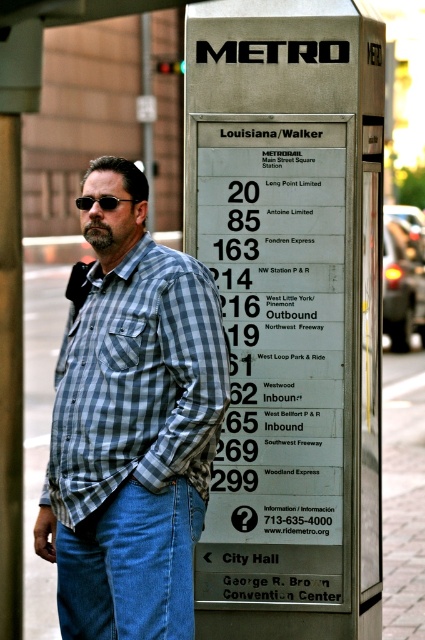
You are a delivery person who needs to read the METRO sign to catch your bus. You notice the metallic silver sign at center and the blue denim jeans at lower left. Which object is wider?

The metallic silver sign at center is wider than the blue denim jeans at lower left.

You are a fashion designer analyzing the man at the bus stop. You need to determine the spatial relationship between his blue denim jeans at lower left and black matte sunglasses at upper left. Which item is positioned closer to you?

The blue denim jeans at lower left is closer to the viewer than the black matte sunglasses at upper left.

You are a pedestrian approaching the bus stop and want to check the bus routes listed on the metallic silver sign at center. Are you able to see the blue denim jeans at lower left while looking at the sign?

The metallic silver sign at center is further to the viewer than blue denim jeans at lower left, so when looking at the sign, the blue denim jeans at lower left would be partially or fully obscured behind the sign.